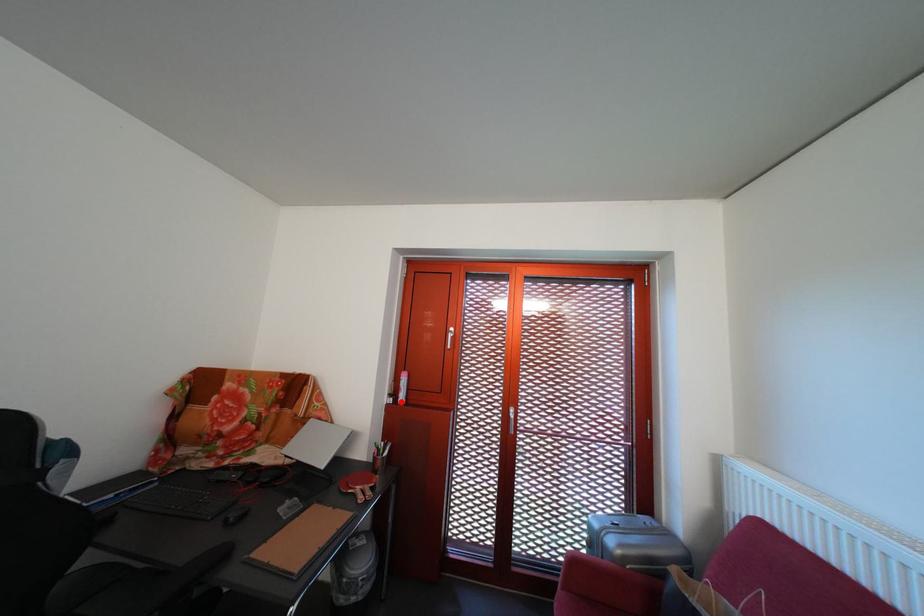
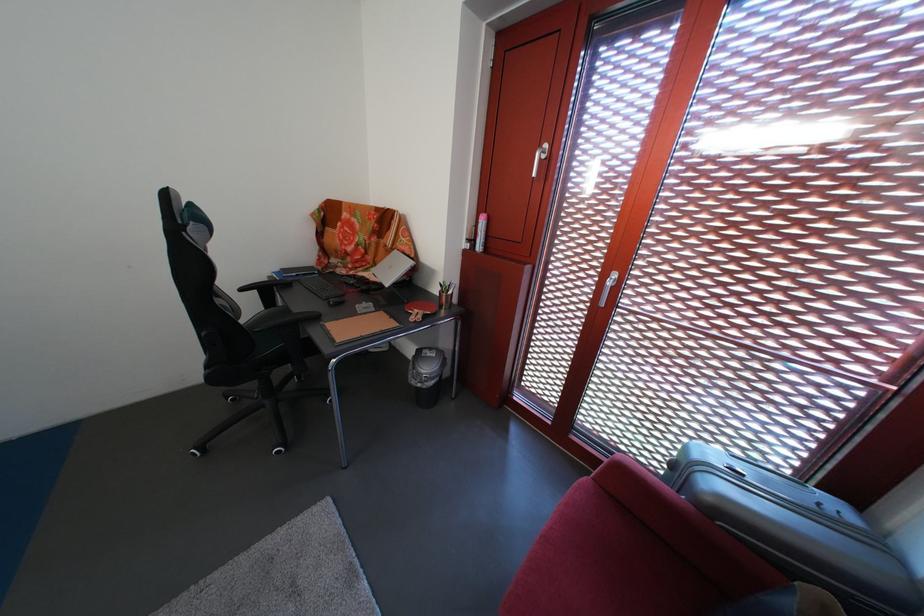
In the second image, find the point that corresponds to the highlighted location in the first image.

(479, 246)